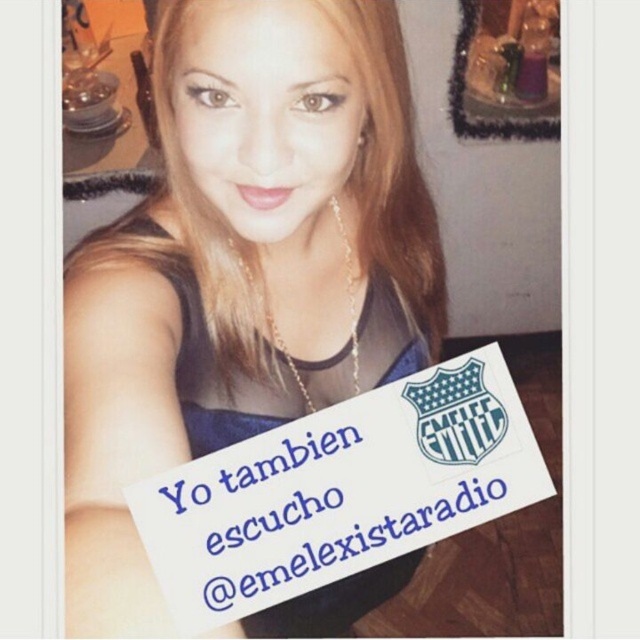
You are a graphic designer asked to place a new sticker between the matte blue sign at center and the white paper sign at center. According to the scene, which sign should the sticker be placed closer to?

The matte blue sign at center is positioned on the left side of white paper sign at center, so the sticker should be placed closer to the matte blue sign at center since it is on the left side of the white paper sign at center.

Based on the photo, you are designing a poster for a music event and need to place two signs in the center. The matte blue sign at center and the white paper sign at center must be arranged so that one is larger than the other. Which sign should you make larger to match the original image?

The matte blue sign at center should be made larger than the white paper sign at center to match the original image.